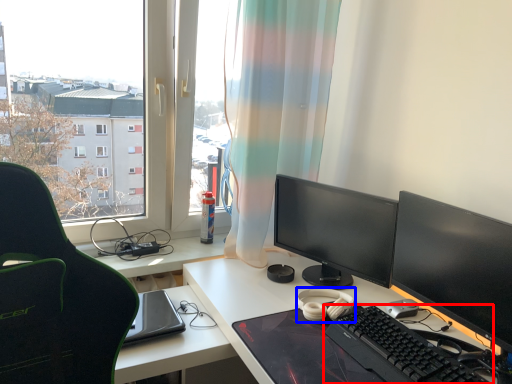
Question: Which object appears closest to the camera in this image, computer keyboard (highlighted by a red box) or headphones (highlighted by a blue box)?

Choices:
 (A) computer keyboard
 (B) headphones

Answer: (A)